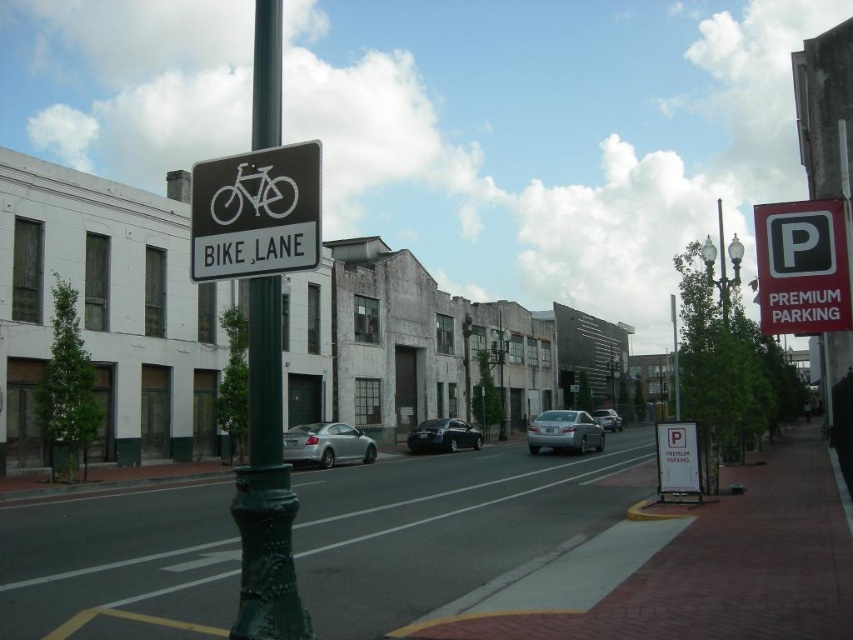
You are a delivery person trying to secure a package on your bike rack. You need to know which object is shorter so you can position your bike accordingly. Which is shorter between the white plastic bike lane sign at upper center and the metallic gray streetlight at center?

The white plastic bike lane sign at upper center is shorter than the metallic gray streetlight at center.

You are a cyclist planning to ride through this street. You see the white plastic bike lane sign at upper center and the metallic gray streetlight at center. Which object is located above the other?

The white plastic bike lane sign at upper center is positioned over the metallic gray streetlight at center.